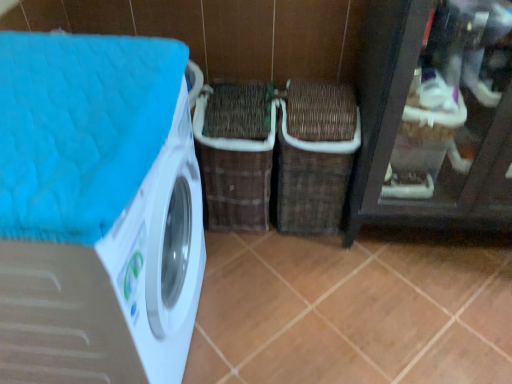
Question: Should I look upward or downward to see brown woven basket at center, placed as the first basket when sorted from left to right?

Choices:
 (A) down
 (B) up

Answer: (B)

Question: Is brown matte tile at center closer to the viewer compared to brown woven basket at center, placed as the second basket when sorted from right to left?

Choices:
 (A) no
 (B) yes

Answer: (B)

Question: Does brown matte tile at center have a greater width compared to brown woven basket at center, placed as the second basket when sorted from right to left?

Choices:
 (A) no
 (B) yes

Answer: (B)

Question: Is the surface of brown matte tile at center in direct contact with brown woven basket at center, placed as the second basket when sorted from right to left?

Choices:
 (A) no
 (B) yes

Answer: (A)

Question: Can you confirm if brown matte tile at center is positioned to the left of brown woven basket at center, placed as the second basket when sorted from right to left?

Choices:
 (A) yes
 (B) no

Answer: (B)

Question: From a real-world perspective, does brown matte tile at center stand above brown woven basket at center, placed as the second basket when sorted from right to left?

Choices:
 (A) yes
 (B) no

Answer: (B)

Question: Would you say brown matte tile at center is outside brown woven basket at center, placed as the second basket when sorted from right to left?

Choices:
 (A) no
 (B) yes

Answer: (B)

Question: From the image's perspective, is woven brown basket at center, which is counted as the 2th basket, starting from the left, on brown matte tile at center?

Choices:
 (A) yes
 (B) no

Answer: (A)

Question: Can you confirm if woven brown basket at center, which is counted as the 2th basket, starting from the left, is taller than brown matte tile at center?

Choices:
 (A) yes
 (B) no

Answer: (A)

Question: Is brown matte tile at center completely or partially inside woven brown basket at center, which is counted as the 2th basket, starting from the left?

Choices:
 (A) yes
 (B) no

Answer: (B)

Question: Is the position of woven brown basket at center, which is counted as the 2th basket, starting from the left, less distant than that of brown matte tile at center?

Choices:
 (A) no
 (B) yes

Answer: (A)

Question: Is woven brown basket at center, which is counted as the 2th basket, starting from the left, not inside brown matte tile at center?

Choices:
 (A) no
 (B) yes

Answer: (B)

Question: Considering the relative sizes of woven brown basket at center, which is counted as the 2th basket, starting from the left, and brown matte tile at center in the image provided, is woven brown basket at center, which is counted as the 2th basket, starting from the left, shorter than brown matte tile at center?

Choices:
 (A) no
 (B) yes

Answer: (A)

Question: Considering the relative sizes of brown woven basket at center, placed as the second basket when sorted from right to left, and brown matte tile at center in the image provided, is brown woven basket at center, placed as the second basket when sorted from right to left, bigger than brown matte tile at center?

Choices:
 (A) no
 (B) yes

Answer: (B)